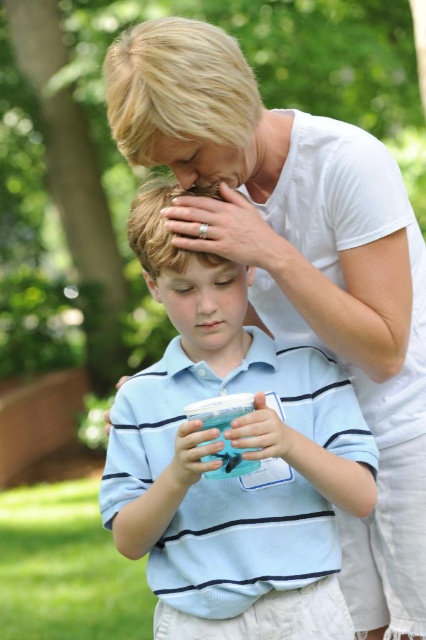
You are a photographer trying to capture the scene where the young boy is holding a container with a small creature. Based on the positions of the blue striped polo shirt at center and the matte white hand at upper center, which object is closer to the bottom of the image?

The blue striped polo shirt at center is located below the matte white hand at upper center, so the blue striped polo shirt at center is closer to the bottom of the image.

You are a child who wants to pour the liquid from the translucent plastic cup at center into the matte plastic cup at lower center. Which cup should you pour into to avoid spilling?

You should pour the liquid from the translucent plastic cup at center into the matte plastic cup at lower center because the matte plastic cup at lower center is taller, providing more space to hold the liquid without spilling.